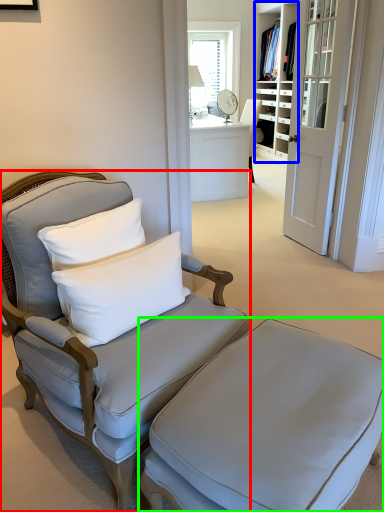
Question: Which is nearer to the chair (highlighted by a red box)? bookshelf (highlighted by a blue box) or table (highlighted by a green box).

Choices:
 (A) bookshelf
 (B) table

Answer: (B)